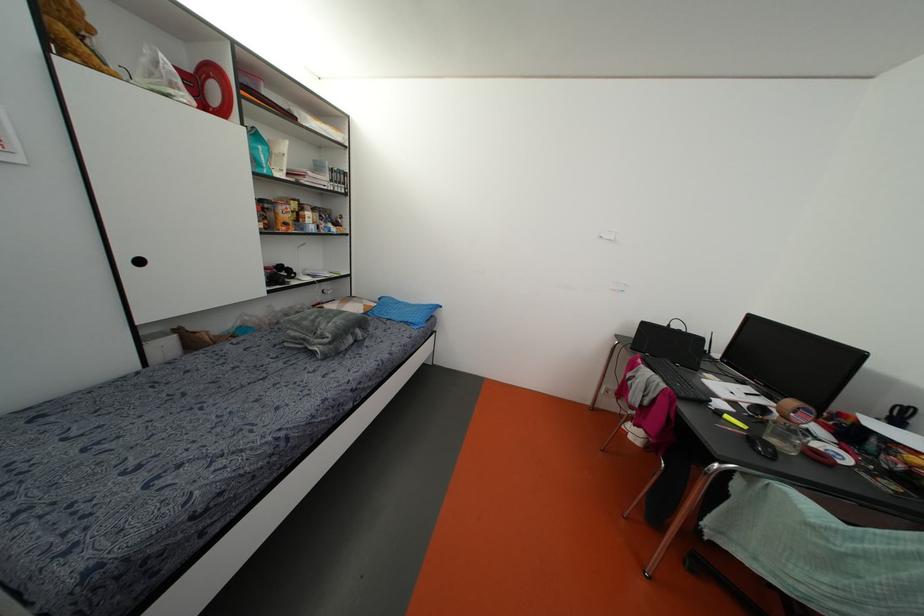
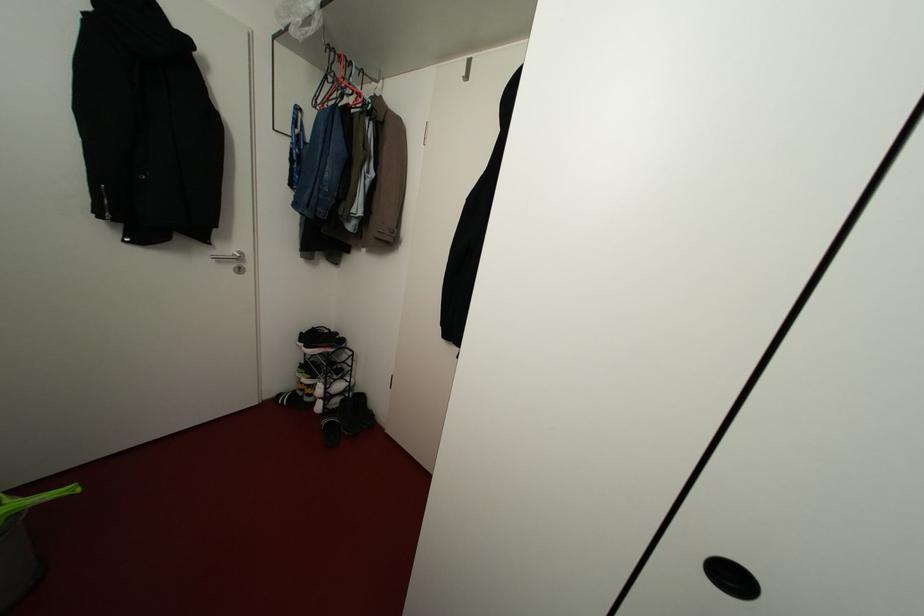
Question: The images are taken continuously from a first-person perspective. In which direction are you moving?

Choices:
 (A) Left
 (B) Right
 (C) Forward
 (D) Backward

Answer: (A)